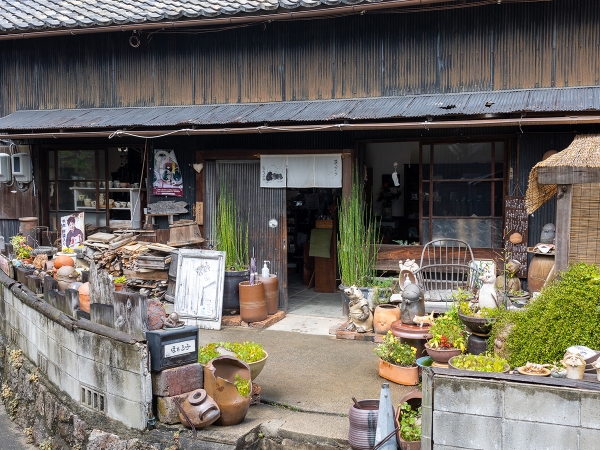
Locate an element on the screen. This screenshot has height=450, width=600. door is located at coordinates (278, 254).